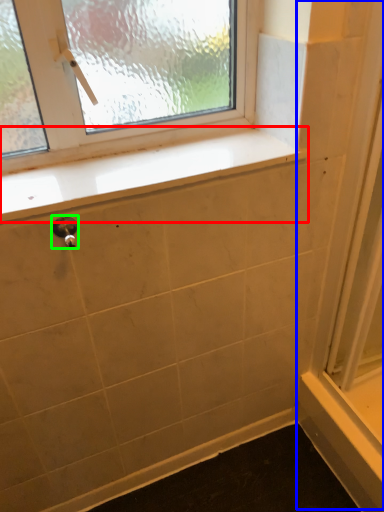
Question: Which is farther away from window sill (highlighted by a red box)? screen door (highlighted by a blue box) or door handle (highlighted by a green box)?

Choices:
 (A) screen door
 (B) door handle

Answer: (A)